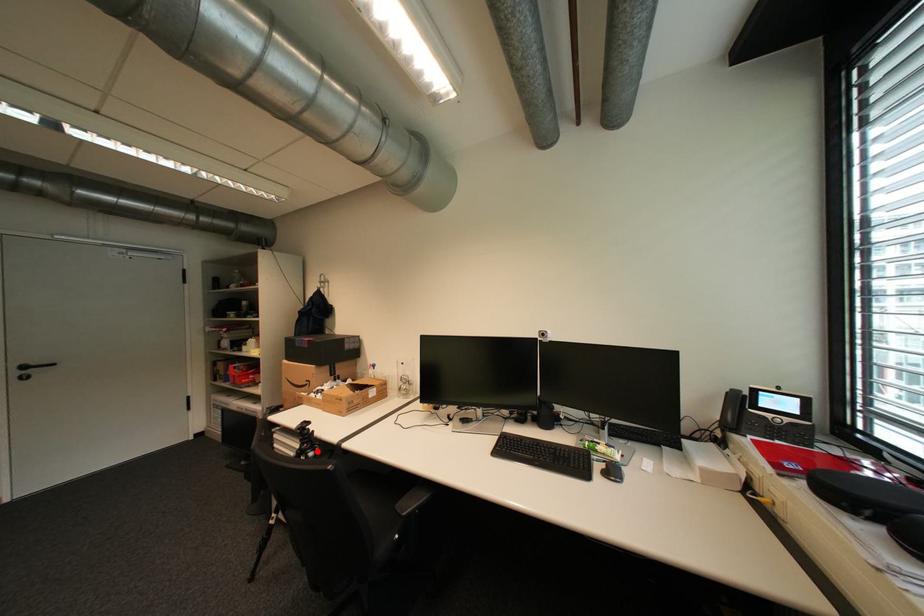
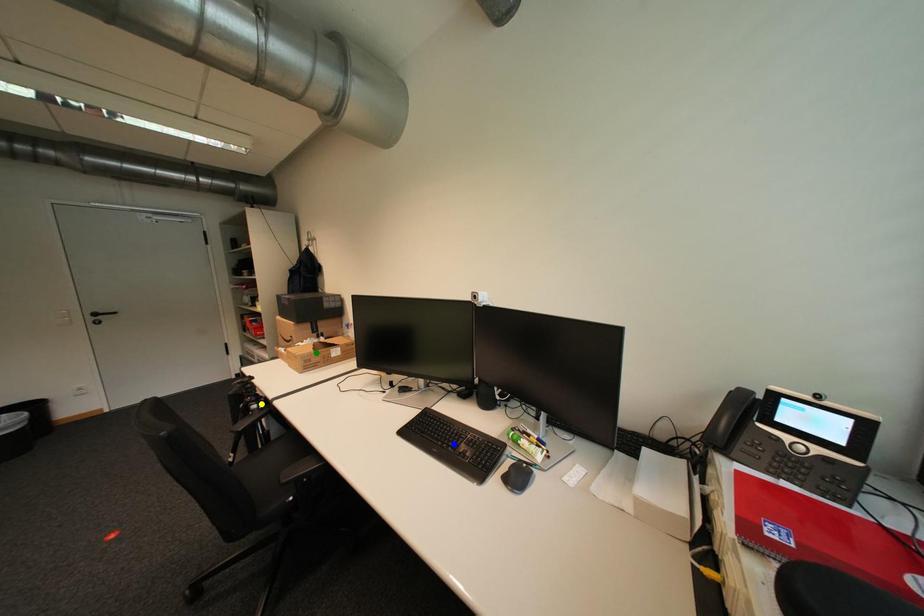
Question: I am providing you with two images of the same scene from different viewpoints. A red point is marked on the first image. You are given multiple points on the second image. In image 2, which mark is for the same physical point as the one in image 1?

Choices:
 (A) yellow point
 (B) blue point
 (C) green point

Answer: (A)